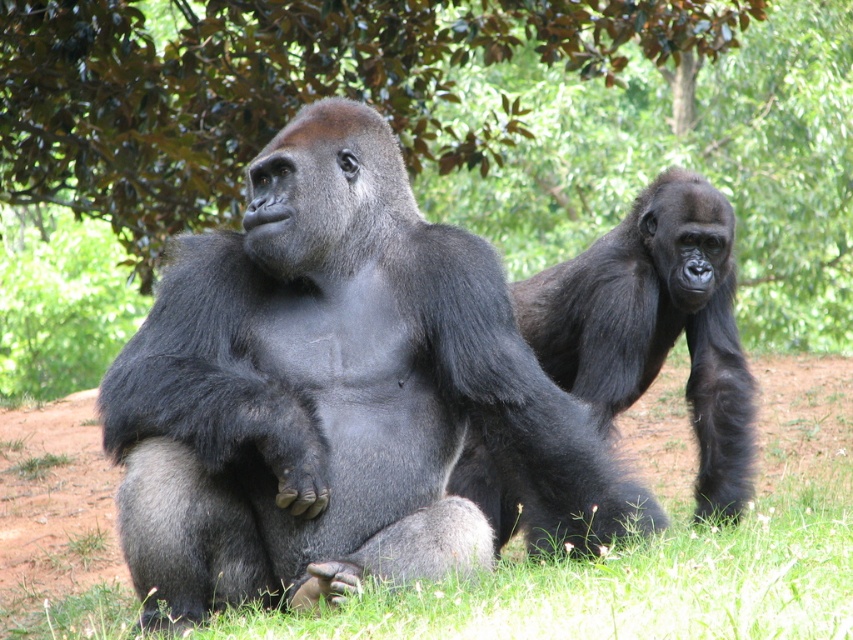
Which is behind, point (380, 440) or point (590, 316)?

Positioned behind is point (590, 316).

You are a GUI agent. You are given a task and a screenshot of the screen. Output one action in this format:
    pyautogui.click(x=<x>, y=<y>)
    Task: Click on the shiny dark fur gorilla at center
    Image resolution: width=853 pixels, height=640 pixels.
    Given the screenshot: What is the action you would take?
    pyautogui.click(x=337, y=394)

Locate an element on the screen. The height and width of the screenshot is (640, 853). shiny dark fur gorilla at center is located at coordinates (337, 394).

Does shiny dark fur gorilla at center lie in front of green soft grass at lower center?

No, it is behind green soft grass at lower center.

Between point (393, 164) and point (468, 602), which one is positioned in front?

Positioned in front is point (468, 602).

Which is behind, point (236, 481) or point (776, 616)?

The point (236, 481) is behind.

Locate an element on the screen. shiny dark fur gorilla at center is located at coordinates (337, 394).

Who is lower down, green soft grass at lower center or black fuzzy gorilla at center?

green soft grass at lower center

Who is more distant from viewer, (695, 536) or (730, 413)?

The point (730, 413) is more distant.

The height and width of the screenshot is (640, 853). Find the location of `green soft grass at lower center`. green soft grass at lower center is located at coordinates (627, 582).

Locate an element on the screen. green soft grass at lower center is located at coordinates (627, 582).